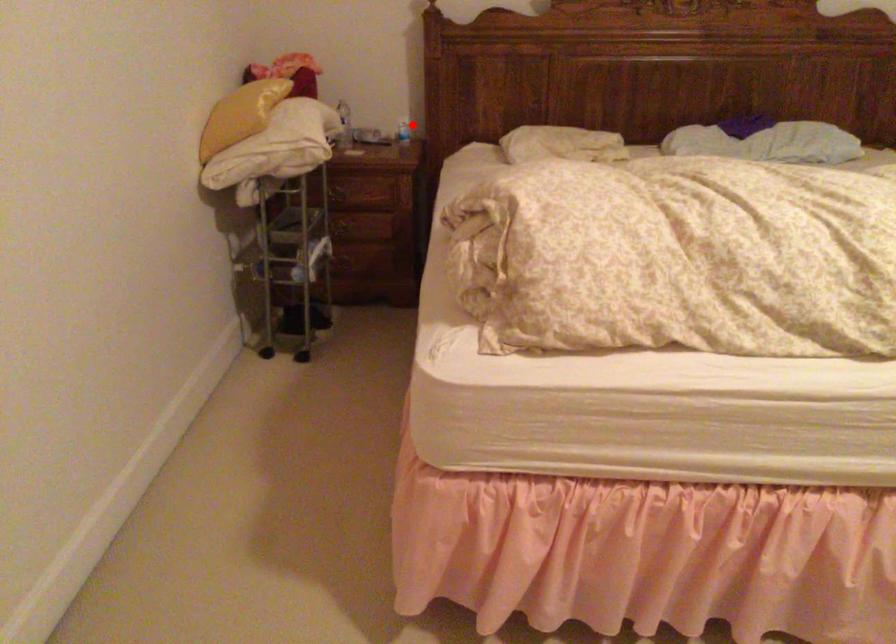
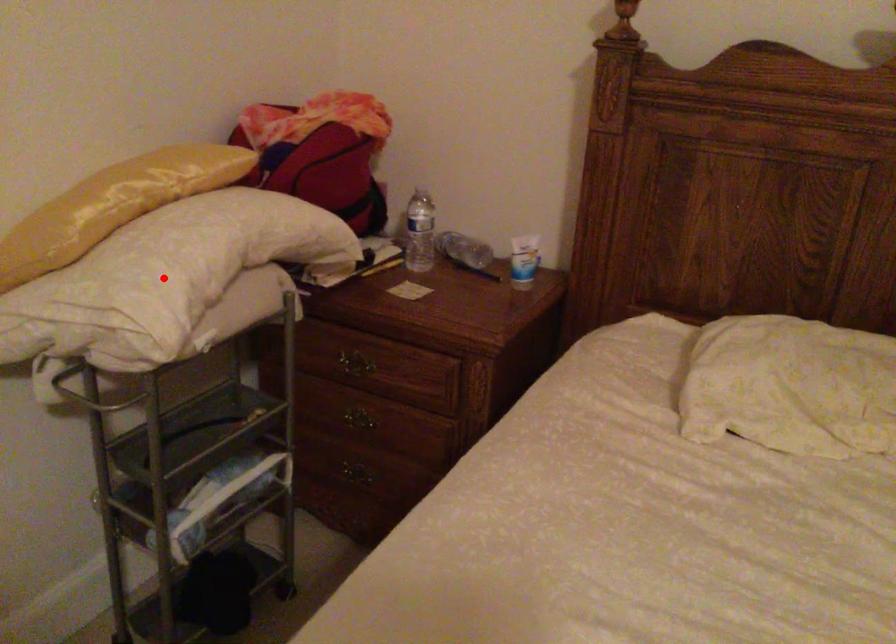
I am providing you with two images of the same scene from different viewpoints. A red point is marked on the first image and another point is marked on the second image. Do the highlighted points in image1 and image2 indicate the same real-world spot?

No